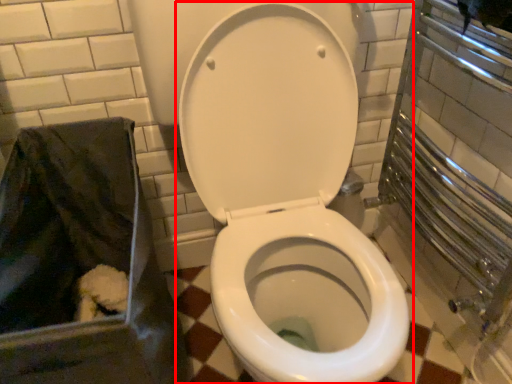
Question: From the image's perspective, where is toilet (annotated by the red box) located relative to recycling bin?

Choices:
 (A) above
 (B) below

Answer: (A)